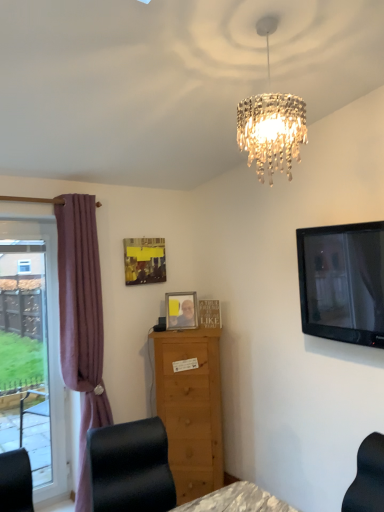
At what (x,y) coordinates should I click in order to perform the action: click on blank space situated above clear glass window at left (from a real-world perspective). Please return your answer as a coordinate pair (x, y). The image size is (384, 512). Looking at the image, I should click on (26, 244).